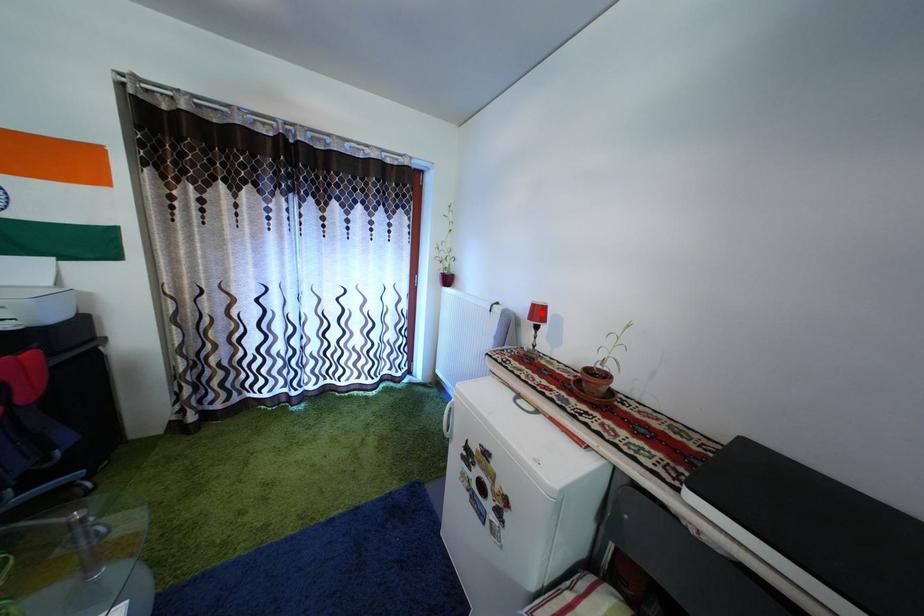
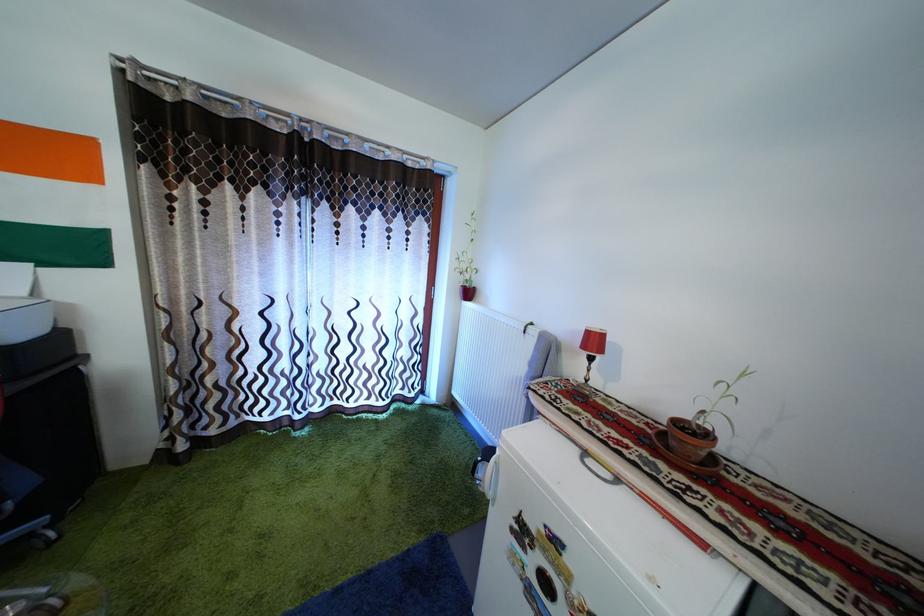
Find the pixel in the second image that matches the highlighted location in the first image.

(598, 339)